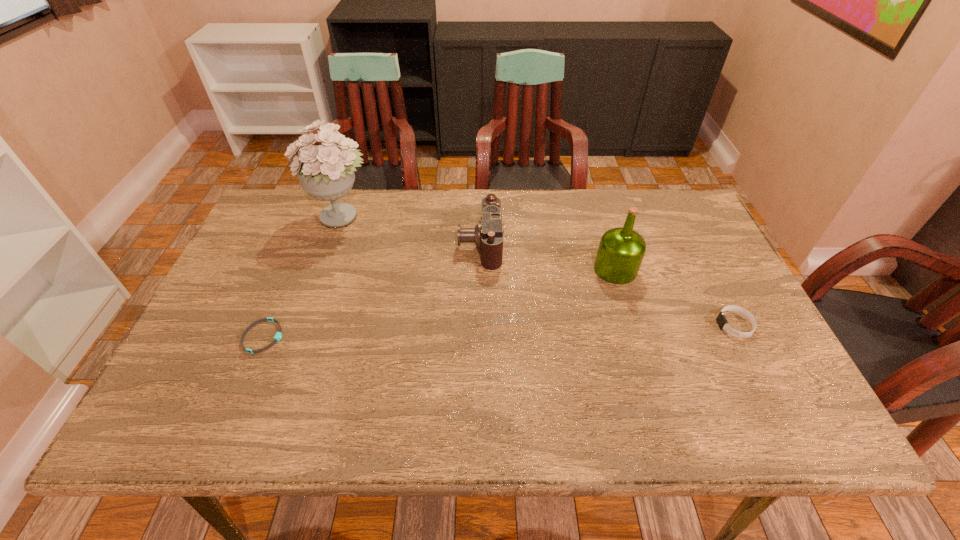
The image size is (960, 540). What are the coordinates of `empty space between the shortest object and the fourth shortest object` in the screenshot? It's located at (440, 303).

Locate an element on the screen. The image size is (960, 540). blank region between the bouquet and the third tallest object is located at coordinates (411, 230).

Locate an element on the screen. The image size is (960, 540). free space between the bouquet and the rightmost object is located at coordinates (539, 271).

Find the location of a particular element. The image size is (960, 540). unoccupied area between the second shortest object and the bouquet is located at coordinates (539, 271).

This screenshot has width=960, height=540. I want to click on empty space that is in between the right wristband and the camera, so click(x=608, y=285).

In order to click on free spot between the camera and the taller wristband in this screenshot , I will do `click(608, 285)`.

Identify the location of vacant area that lies between the left wristband and the camera. (372, 291).

Where is `unoccupied position between the second object from right to left and the right wristband`? This screenshot has height=540, width=960. unoccupied position between the second object from right to left and the right wristband is located at coordinates (675, 298).

Locate an element on the screen. vacant area that lies between the bouquet and the right wristband is located at coordinates (539, 271).

The width and height of the screenshot is (960, 540). What are the coordinates of `empty space between the second object from right to left and the third tallest object` in the screenshot? It's located at (548, 257).